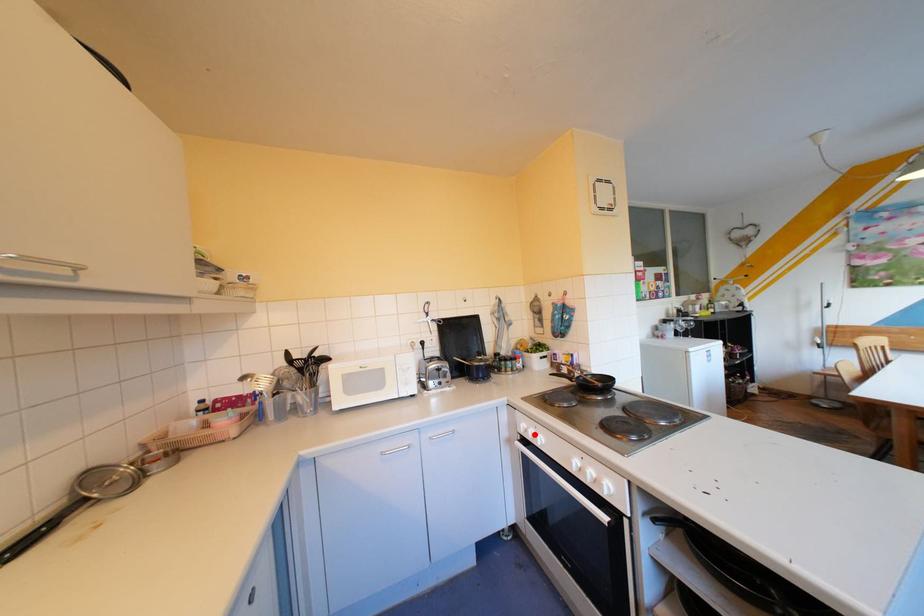
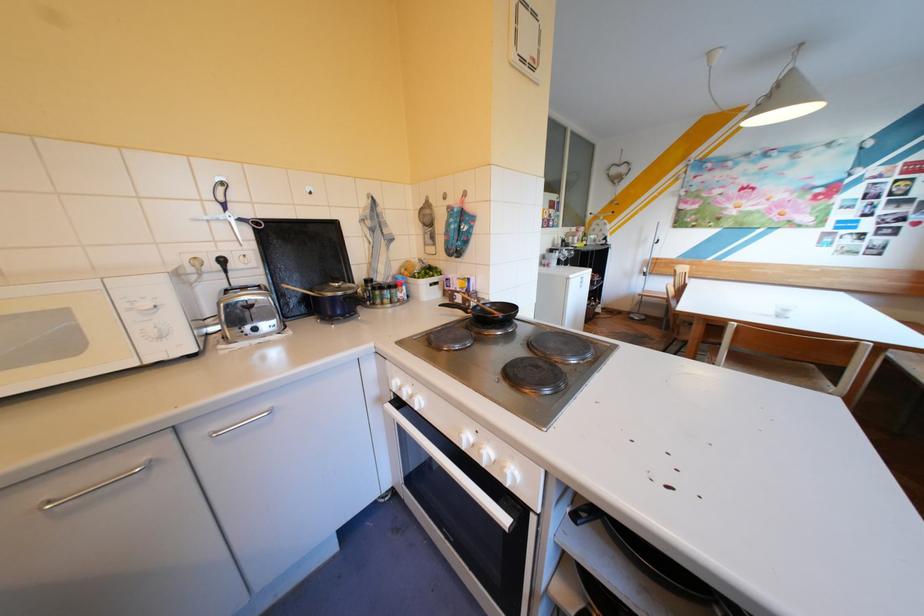
In the second image, find the point that corresponds to the highlighted location in the first image.

(407, 392)